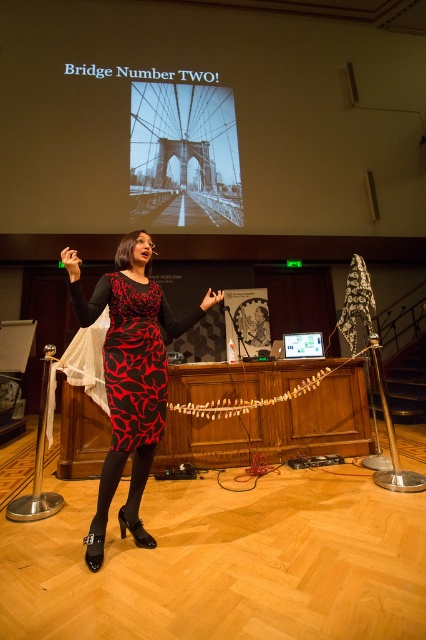
Can you confirm if printed fabric dress at center is bigger than black glass bridge at upper center?

Actually, printed fabric dress at center might be smaller than black glass bridge at upper center.

Is point (120, 250) in front of point (198, 218)?

Yes, point (120, 250) is in front of point (198, 218).

Who is more distant from viewer, [101,513] or [236,179]?

The point [236,179] is behind.

Locate an element on the screen. printed fabric dress at center is located at coordinates (x=129, y=376).

Does black glass bridge at upper center lie in front of matte plastic screen at center?

No.

Can you confirm if black glass bridge at upper center is positioned to the right of matte plastic screen at center?

In fact, black glass bridge at upper center is to the left of matte plastic screen at center.

Locate an element on the screen. The image size is (426, 640). black glass bridge at upper center is located at coordinates (184, 154).

The width and height of the screenshot is (426, 640). Find the location of `black glass bridge at upper center`. black glass bridge at upper center is located at coordinates (184, 154).

Measure the distance between printed fabric dress at center and black leather high-heeled shoe at lower left.

printed fabric dress at center and black leather high-heeled shoe at lower left are 8.95 inches apart.

Does printed fabric dress at center have a lesser width compared to black leather high-heeled shoe at lower left?

Incorrect, printed fabric dress at center's width is not less than black leather high-heeled shoe at lower left's.

Locate an element on the screen. This screenshot has width=426, height=640. printed fabric dress at center is located at coordinates (129, 376).